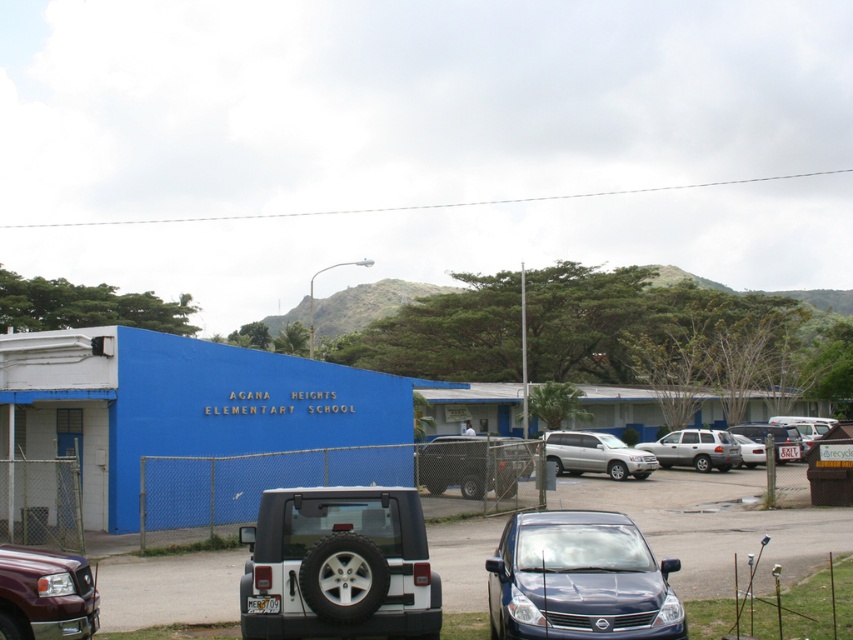
Is white matte jeep at lower center below black plastic license plate at center?

Actually, white matte jeep at lower center is above black plastic license plate at center.

Between white matte jeep at lower center and black plastic license plate at center, which one has more height?

With more height is white matte jeep at lower center.

Is point (418, 544) less distant than point (782, 454)?

Yes, it is.

Where is `white matte jeep at lower center`? white matte jeep at lower center is located at coordinates (340, 564).

Does point (541, 528) come in front of point (711, 445)?

Yes, point (541, 528) is in front of point (711, 445).

Can you confirm if glossy blue car at center is positioned to the right of silver metallic suv at center?

No, glossy blue car at center is not to the right of silver metallic suv at center.

Identify the location of glossy blue car at center. Image resolution: width=853 pixels, height=640 pixels. (579, 579).

Where is `glossy blue car at center`? glossy blue car at center is located at coordinates (579, 579).

In the scene shown: Does white matte jeep at lower center appear on the left side of silver metallic suv at center?

Yes, white matte jeep at lower center is to the left of silver metallic suv at center.

Describe the element at coordinates (340, 564) in the screenshot. I see `white matte jeep at lower center` at that location.

The image size is (853, 640). I want to click on white matte jeep at lower center, so 340,564.